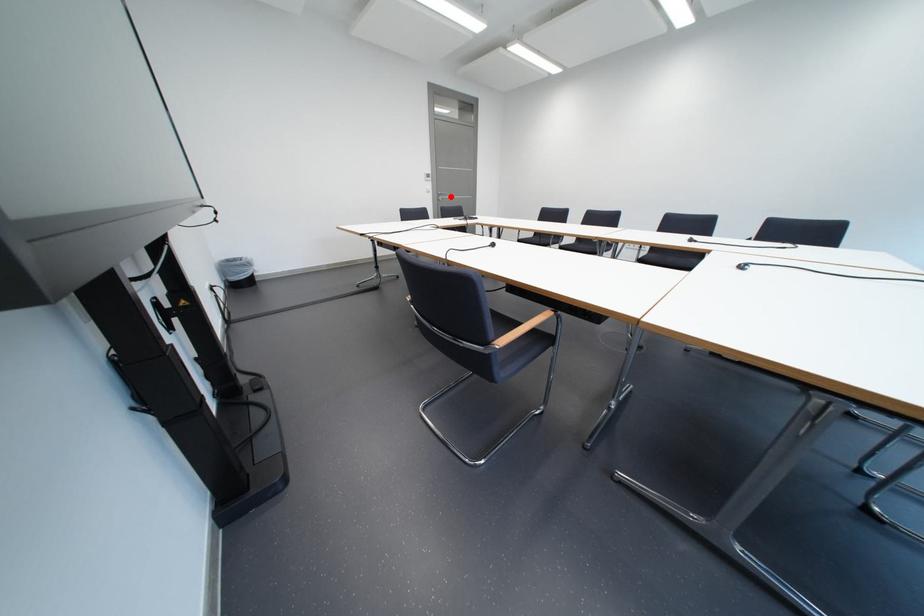
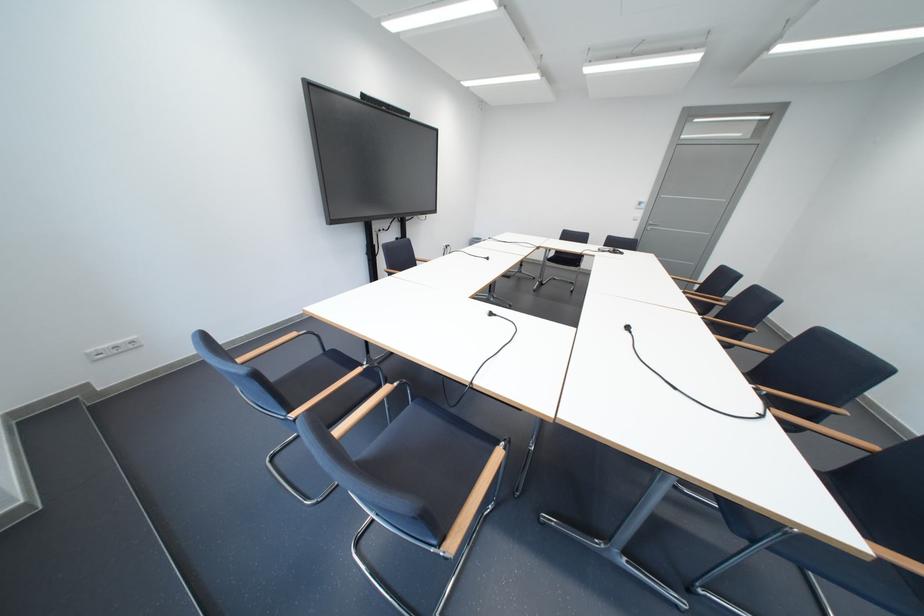
The point at the highlighted location is marked in the first image. Where is the corresponding point in the second image?

(660, 227)